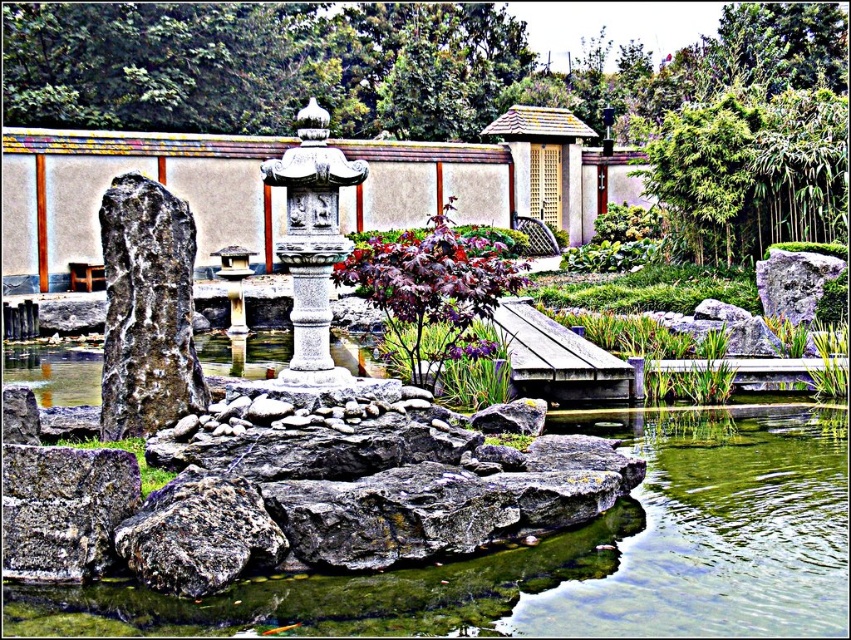
You are standing in the Japanese garden and want to place a small decorative rock. You have two options for placement at the coordinates point (113, 461) and point (770, 310). Which coordinate location is closer to you where you are standing?

Point (113, 461) is closer to the viewer than point (770, 310), so you should place the decorative rock at point (113, 461).

You are standing in a Japanese garden and see the greenish water at center. If you want to throw a stone into the water, will you be able to reach it from your current position?

The greenish water at center is 11.65 meters away from the viewer. Since the average throwing distance for a stone is around 10 meters, you would not be able to reach it without moving closer.

You are a gardener who wants to place a decorative stone at the exact center of the Japanese garden. However, there is already a purple matte leathery leaf at point [433,284]. Can you confirm if this leaf is located exactly at the center of the garden?

The purple matte leathery leaf at center is located at point [433,284], which is the exact center of the garden.